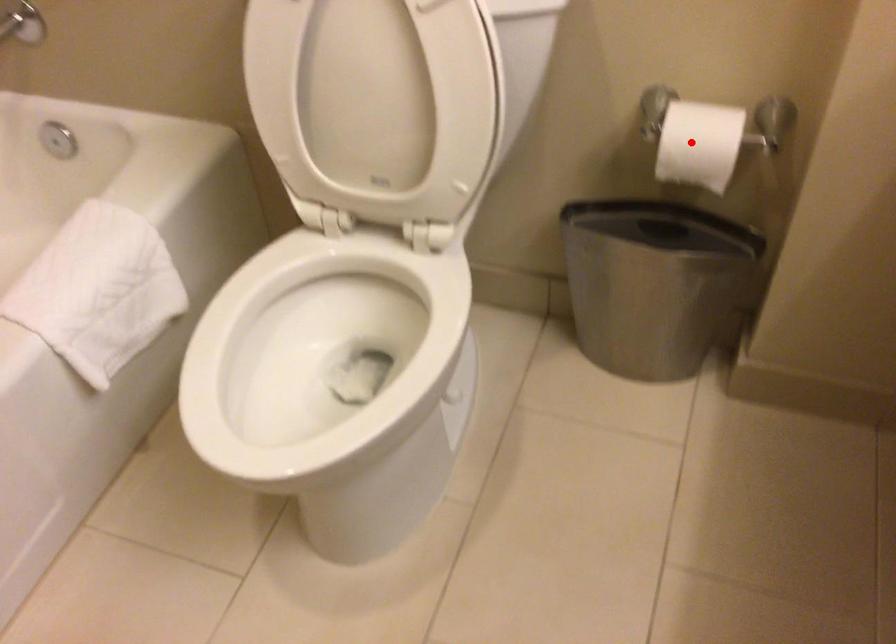
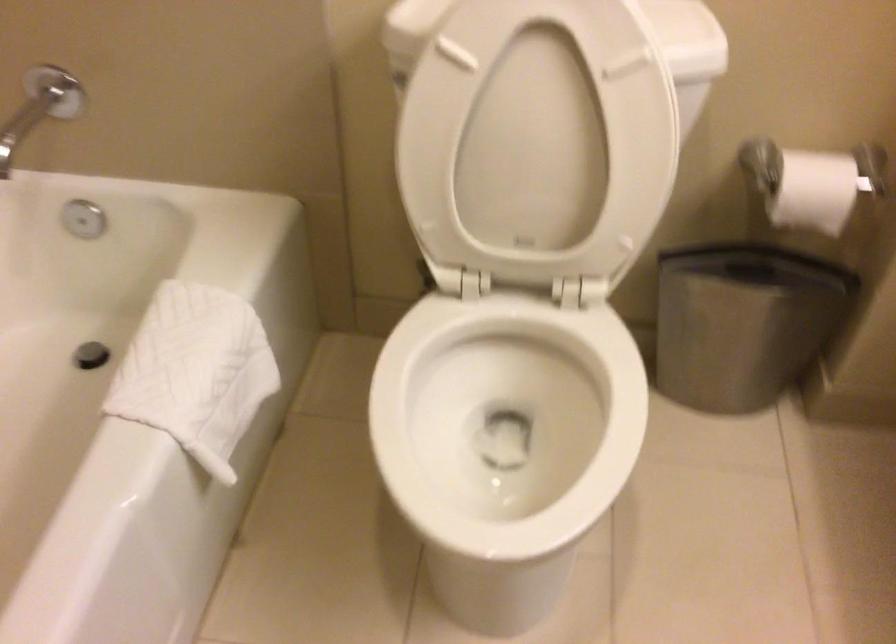
The point at the highlighted location is marked in the first image. Where is the corresponding point in the second image?

(812, 183)